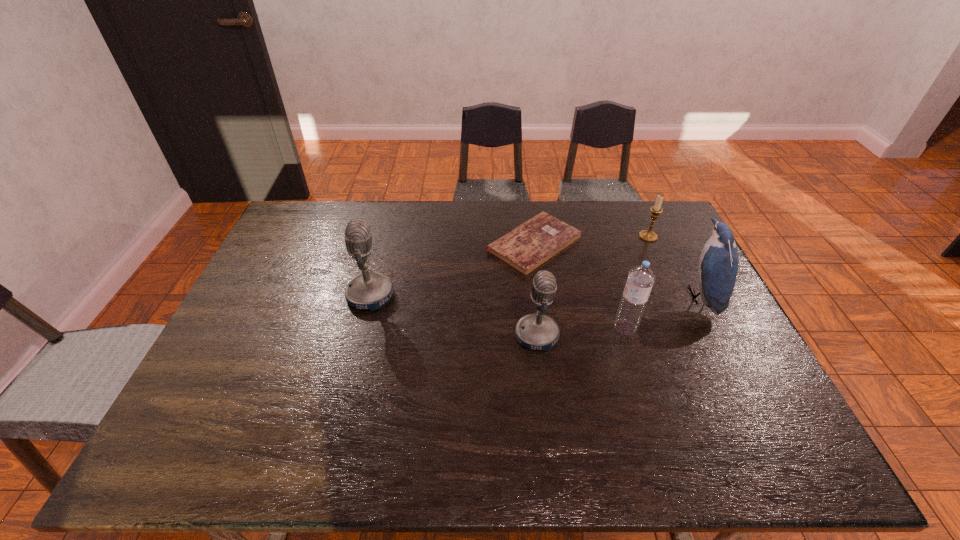
Observe the arrangement of all microphones in the image. To keep them evenly spaced, where would you place another microphone on the right? Please locate a free space. Please provide its 2D coordinates. Your answer should be formatted as a tuple, i.e. [(x, y)], where the tuple contains the x and y coordinates of a point satisfying the conditions above.

[(737, 384)]